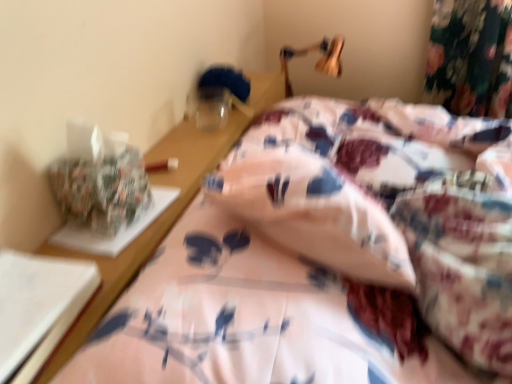
Question: Looking at the image, does wooden table lamp at upper center seem bigger or smaller compared to floral fabric bed at center?

Choices:
 (A) big
 (B) small

Answer: (B)

Question: Is wooden table lamp at upper center taller or shorter than floral fabric bed at center?

Choices:
 (A) tall
 (B) short

Answer: (A)

Question: Considering the relative positions of wooden table lamp at upper center and floral fabric bed at center in the image provided, is wooden table lamp at upper center to the left or to the right of floral fabric bed at center?

Choices:
 (A) left
 (B) right

Answer: (B)

Question: Is point (315, 302) closer or farther from the camera than point (287, 56)?

Choices:
 (A) closer
 (B) farther

Answer: (A)

Question: Which is correct: floral fabric bed at center is inside wooden table lamp at upper center, or outside of it?

Choices:
 (A) inside
 (B) outside

Answer: (B)

Question: Is floral fabric bed at center in front of or behind wooden table lamp at upper center in the image?

Choices:
 (A) front
 (B) behind

Answer: (A)

Question: From the image's perspective, is floral fabric bed at center above or below wooden table lamp at upper center?

Choices:
 (A) below
 (B) above

Answer: (A)